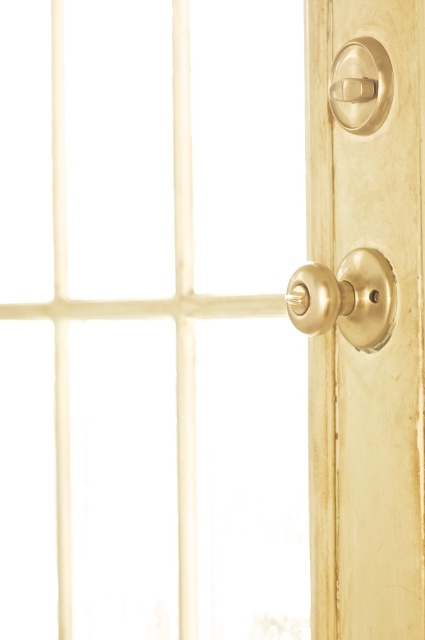
Is gold polished knob at center right smaller than polished brass knob at upper right?

No.

Where is `gold polished knob at center right`? The width and height of the screenshot is (425, 640). gold polished knob at center right is located at coordinates (345, 298).

Between brass knob at right and polished brass knob at upper right, which one is positioned lower?

brass knob at right is below.

Which is behind, point (408, 576) or point (384, 86)?

The point (408, 576) is more distant.

Find the location of `brass knob at right`. brass knob at right is located at coordinates (362, 353).

From the picture: Is brass knob at right positioned behind gold polished knob at center right?

Yes, it is behind gold polished knob at center right.

Does brass knob at right appear on the right side of gold polished knob at center right?

Correct, you'll find brass knob at right to the right of gold polished knob at center right.

This screenshot has width=425, height=640. Describe the element at coordinates (362, 353) in the screenshot. I see `brass knob at right` at that location.

This screenshot has height=640, width=425. Find the location of `brass knob at right`. brass knob at right is located at coordinates (362, 353).